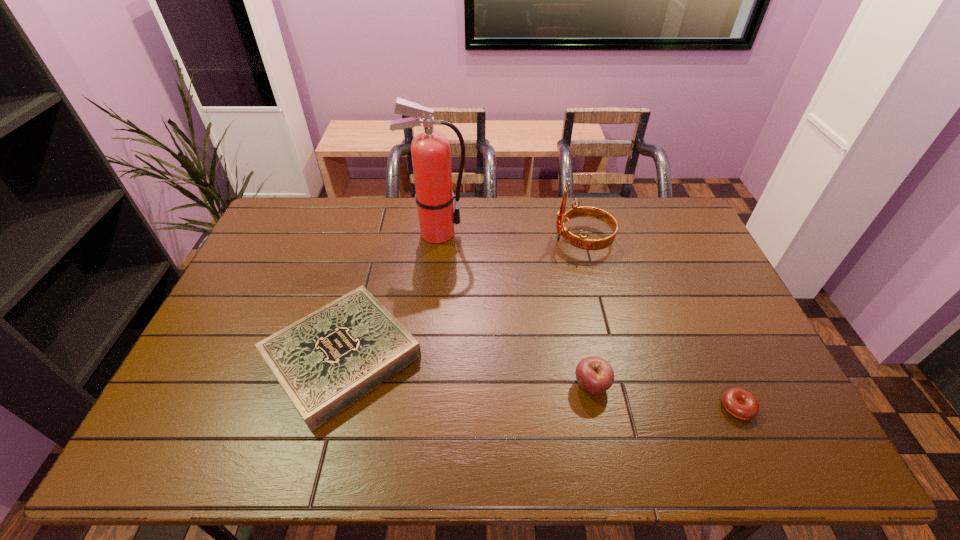
Locate an element on the screen. free spot that satisfies the following two spatial constraints: 1. on the side of the third tallest object with the unique marking; 2. on the left side of the doughnut is located at coordinates (596, 407).

Identify the location of blank area in the image that satisfies the following two spatial constraints: 1. on the hose direction of the tallest object; 2. on the right side of the shortest object. (418, 407).

This screenshot has width=960, height=540. In order to click on free space that satisfies the following two spatial constraints: 1. on the hose direction of the tallest object; 2. on the back side of the shortest object in this screenshot , I will do `click(418, 407)`.